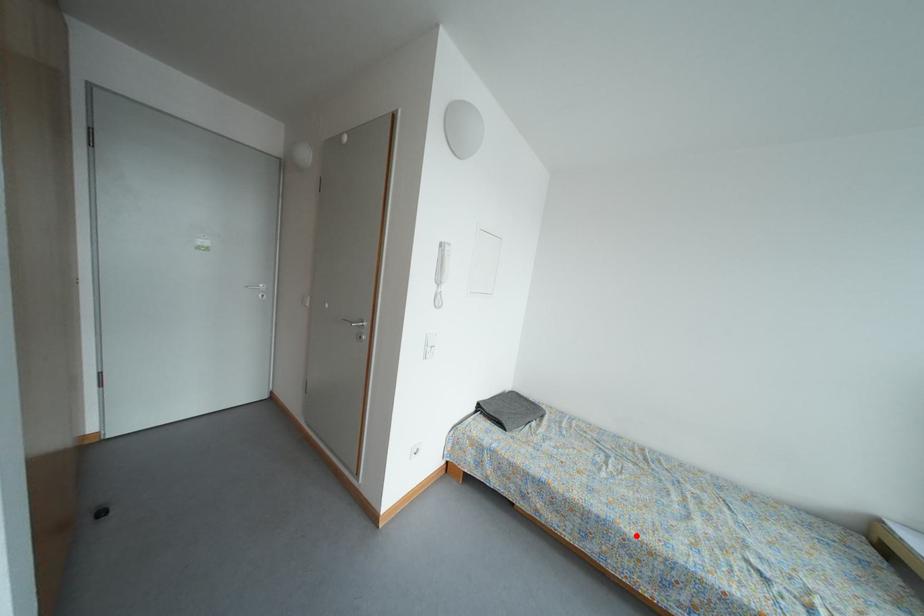
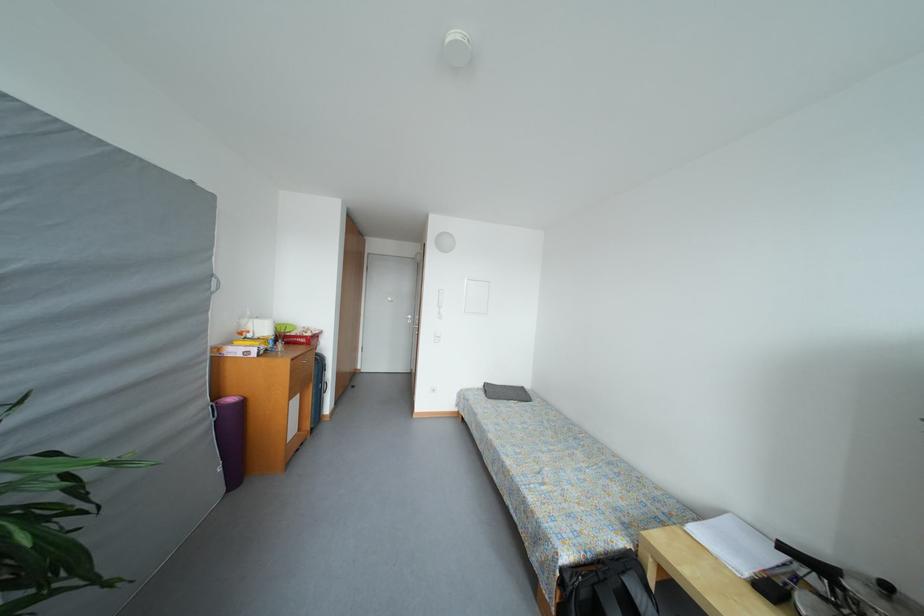
Where in the second image is the point corresponding to the highlighted location from the first image?

(496, 440)